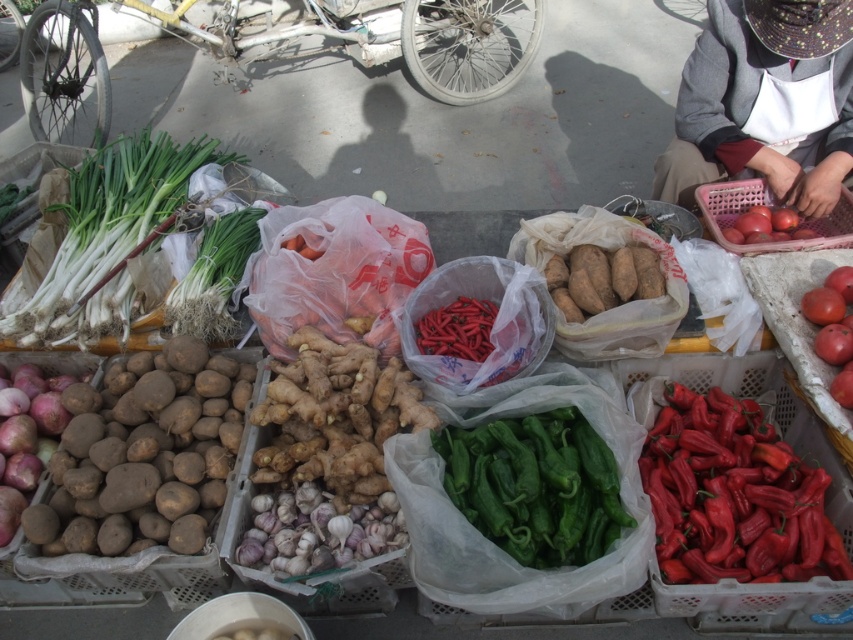
Question: Is green leafy at center further to camera compared to matte plastic tomatoes at right?

Choices:
 (A) yes
 (B) no

Answer: (B)

Question: Which of the following is the closest to the observer?

Choices:
 (A) matte plastic tomatoes at right
 (B) green matte pepper at center
 (C) green leafy stems at left
 (D) brown rough potatoes at left

Answer: (B)

Question: Which object is farther from the camera taking this photo?

Choices:
 (A) red matte tomato at center right
 (B) green plastic bag at upper center

Answer: (B)

Question: Which of the following is the farthest from the observer?

Choices:
 (A) white cotton apron at upper right
 (B) green plastic bag at upper center
 (C) green matte pepper at center
 (D) brown rough potatoes at left

Answer: (B)

Question: Can you confirm if green leafy stems at left is wider than green leafy at center?

Choices:
 (A) yes
 (B) no

Answer: (A)

Question: Is red glossy chili peppers at right thinner than green matte pepper at center?

Choices:
 (A) yes
 (B) no

Answer: (B)